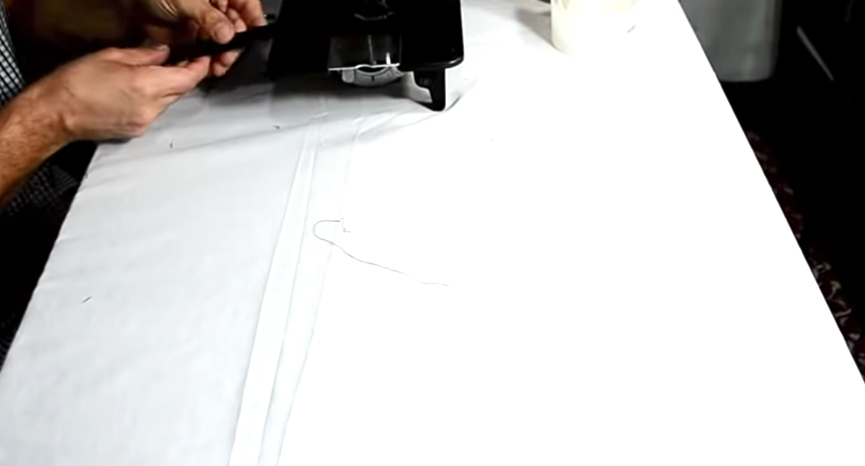
Image resolution: width=865 pixels, height=466 pixels. In order to click on walls in this screenshot , I will do `click(727, 42)`.